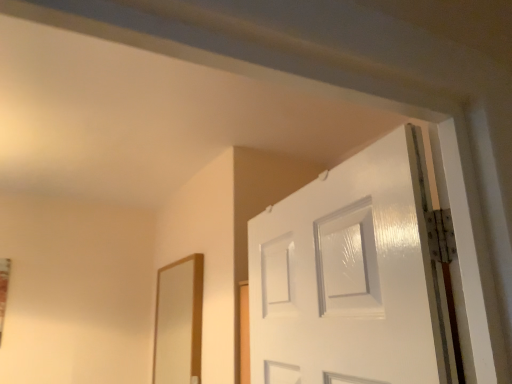
Image resolution: width=512 pixels, height=384 pixels. Describe the element at coordinates (179, 321) in the screenshot. I see `wooden mirror at left` at that location.

This screenshot has height=384, width=512. What are the coordinates of `wooden mirror at left` in the screenshot? It's located at (179, 321).

Locate an element on the screen. This screenshot has width=512, height=384. wooden mirror at left is located at coordinates (179, 321).